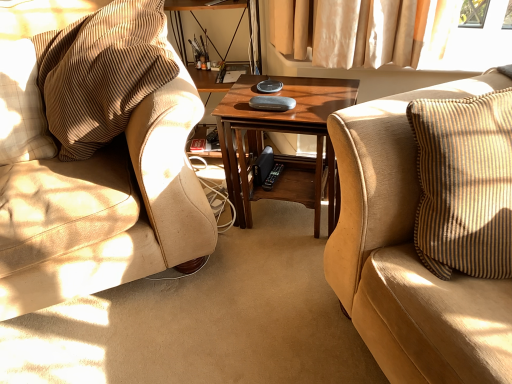
Locate an element on the screen. The width and height of the screenshot is (512, 384). suede beige couch at right is located at coordinates (408, 254).

What do you see at coordinates (284, 132) in the screenshot? I see `wooden coffee table at center` at bounding box center [284, 132].

Find the location of a particular element. The image size is (512, 384). wooden coffee table at center is located at coordinates (284, 132).

Measure the distance between point (133, 268) and camera.

They are 4.69 feet apart.

Locate an element on the screen. The width and height of the screenshot is (512, 384). beige textured pillow at left is located at coordinates (22, 106).

Is brown corduroy chair at left oriented away from beige textured pillow at left?

No, beige textured pillow at left is not at the back of brown corduroy chair at left.

Between brown corduroy chair at left and beige textured pillow at left, which one is positioned in front?

brown corduroy chair at left is more forward.

Considering the points (203, 234) and (24, 122), which point is behind, point (203, 234) or point (24, 122)?

The point (203, 234) is farther.

Considering the sizes of objects brown corduroy chair at left and beige textured pillow at left in the image provided, who is taller, brown corduroy chair at left or beige textured pillow at left?

brown corduroy chair at left.

Is wooden coffee table at center located outside suede beige couch at right?

wooden coffee table at center lies outside suede beige couch at right's area.

Between point (328, 79) and point (426, 286), which one is positioned behind?

The point (328, 79) is behind.

Which of these two, wooden coffee table at center or suede beige couch at right, stands taller?

suede beige couch at right is taller.

From the image's perspective, is beige textured pillow at left positioned above or below brown corduroy chair at left?

beige textured pillow at left is below brown corduroy chair at left.

Between beige textured pillow at left and brown corduroy chair at left, which one appears on the right side from the viewer's perspective?

brown corduroy chair at left is more to the right.

Which point is more distant from viewer, (4,78) or (17,268)?

The point (4,78) is farther from the camera.

Is beige textured pillow at left looking in the opposite direction of brown corduroy chair at left?

Correct, beige textured pillow at left is looking away from brown corduroy chair at left.

Are suede beige couch at right and beige textured pillow at left beside each other?

They are not placed beside each other.

Between suede beige couch at right and beige textured pillow at left, which one has smaller size?

beige textured pillow at left is smaller.

From the image's perspective, is suede beige couch at right on beige textured pillow at left?

No, from the image's perspective, suede beige couch at right is not on top of beige textured pillow at left.

How many degrees apart are the facing directions of suede beige couch at right and beige textured pillow at left?

They differ by 91.5 degrees in their facing directions.

From the image's perspective, which is above, suede beige couch at right or brown corduroy chair at left?

brown corduroy chair at left, from the image's perspective.

Looking at this image, considering the relative positions of suede beige couch at right and brown corduroy chair at left in the image provided, is suede beige couch at right to the left or to the right of brown corduroy chair at left?

Clearly, suede beige couch at right is on the right of brown corduroy chair at left in the image.

Is point (430, 317) closer to viewer compared to point (85, 261)?

Yes, point (430, 317) is closer to viewer.

Is suede beige couch at right touching brown corduroy chair at left?

suede beige couch at right and brown corduroy chair at left are not in contact.

Based on their sizes in the image, would you say wooden coffee table at center is bigger or smaller than beige textured pillow at left?

Clearly, wooden coffee table at center is larger in size than beige textured pillow at left.

From the image's perspective, between wooden coffee table at center and beige textured pillow at left, who is located below?

wooden coffee table at center, from the image's perspective.

Considering the sizes of wooden coffee table at center and beige textured pillow at left in the image, is wooden coffee table at center taller or shorter than beige textured pillow at left?

Clearly, wooden coffee table at center is taller compared to beige textured pillow at left.

This screenshot has width=512, height=384. I want to click on pillow that appears on the left of wooden coffee table at center, so click(x=22, y=106).

Who is taller, brown corduroy chair at left or suede beige couch at right?

suede beige couch at right is taller.

Based on the photo, is brown corduroy chair at left placed right next to suede beige couch at right?

No.

Which point is more forward, (154,201) or (410,178)?

Point (410,178)

Where is `chair on the right of beige textured pillow at left`? Image resolution: width=512 pixels, height=384 pixels. chair on the right of beige textured pillow at left is located at coordinates pos(105,209).

The width and height of the screenshot is (512, 384). Find the location of `coffee table behind the suede beige couch at right`. coffee table behind the suede beige couch at right is located at coordinates (284, 132).

Considering their positions, is beige textured pillow at left positioned further to wooden coffee table at center than brown corduroy chair at left?

Based on the image, beige textured pillow at left appears to be further to wooden coffee table at center.

When comparing their distances from wooden coffee table at center, does suede beige couch at right or beige textured pillow at left seem further?

beige textured pillow at left is further to wooden coffee table at center.

Considering their positions, is wooden coffee table at center positioned closer to beige textured pillow at left than suede beige couch at right?

wooden coffee table at center is positioned closer to the anchor beige textured pillow at left.

From the image, which object appears to be nearer to brown corduroy chair at left, wooden coffee table at center or suede beige couch at right?

wooden coffee table at center.

Which object lies nearer to the anchor point beige textured pillow at left, wooden coffee table at center or brown corduroy chair at left?

brown corduroy chair at left.

Estimate the real-world distances between objects in this image. Which object is further from beige textured pillow at left, suede beige couch at right or brown corduroy chair at left?

Among the two, suede beige couch at right is located further to beige textured pillow at left.

Looking at the image, which one is located closer to suede beige couch at right, brown corduroy chair at left or wooden coffee table at center?

The object closer to suede beige couch at right is wooden coffee table at center.

From the image, which object appears to be nearer to beige textured pillow at left, brown corduroy chair at left or suede beige couch at right?

Among the two, brown corduroy chair at left is located nearer to beige textured pillow at left.

Locate an element on the screen. Image resolution: width=512 pixels, height=384 pixels. chair situated between beige textured pillow at left and suede beige couch at right from left to right is located at coordinates (105, 209).

You are a GUI agent. You are given a task and a screenshot of the screen. Output one action in this format:
    pyautogui.click(x=<x>, y=<y>)
    Task: Click on the coffee table between brown corduroy chair at left and suede beige couch at right from left to right
    This screenshot has width=512, height=384.
    Given the screenshot: What is the action you would take?
    pyautogui.click(x=284, y=132)

The width and height of the screenshot is (512, 384). What are the coordinates of `coffee table between beige textured pillow at left and suede beige couch at right` in the screenshot? It's located at (284, 132).

Where is `chair situated between beige textured pillow at left and wooden coffee table at center from left to right`? chair situated between beige textured pillow at left and wooden coffee table at center from left to right is located at coordinates (105, 209).